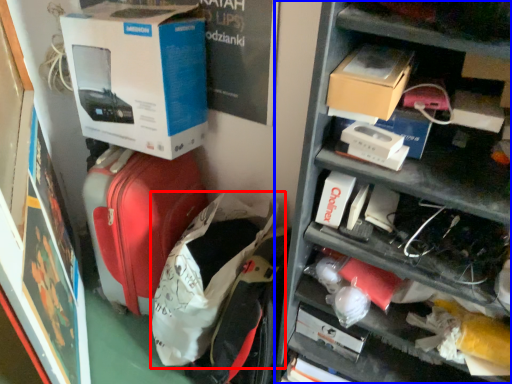
Question: Which of the following is the farthest to the observer, luggage (highlighted by a red box) or shelf (highlighted by a blue box)?

Choices:
 (A) luggage
 (B) shelf

Answer: (A)